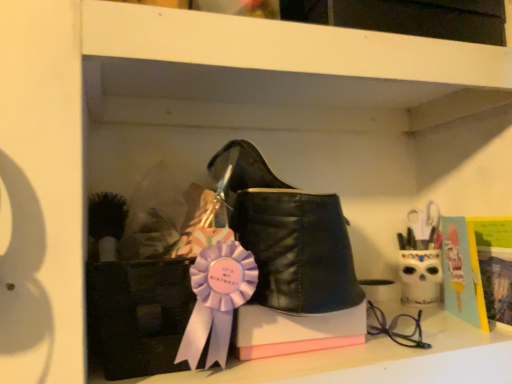
Locate an element on the screen. This screenshot has width=512, height=384. vacant space in front of matte black glasses at lower right is located at coordinates (386, 353).